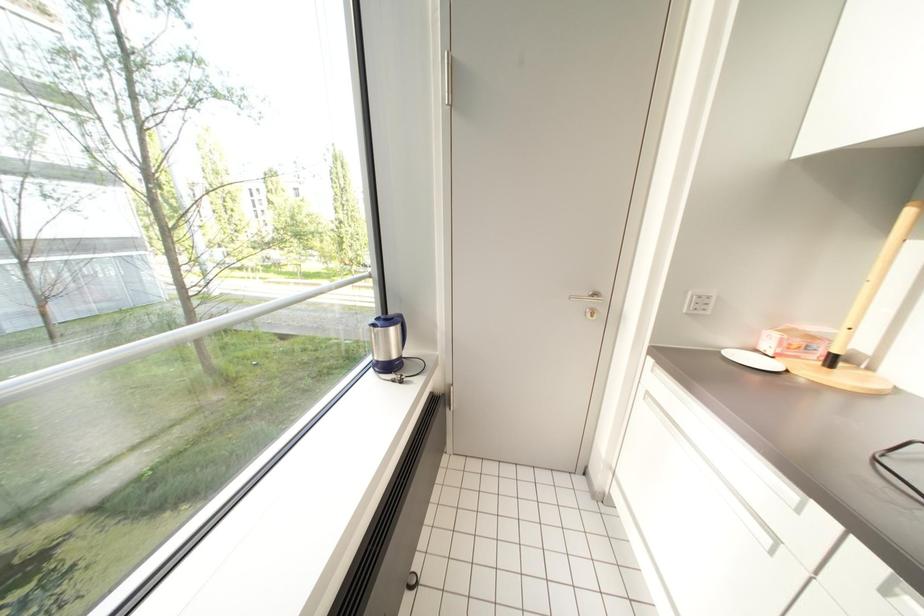
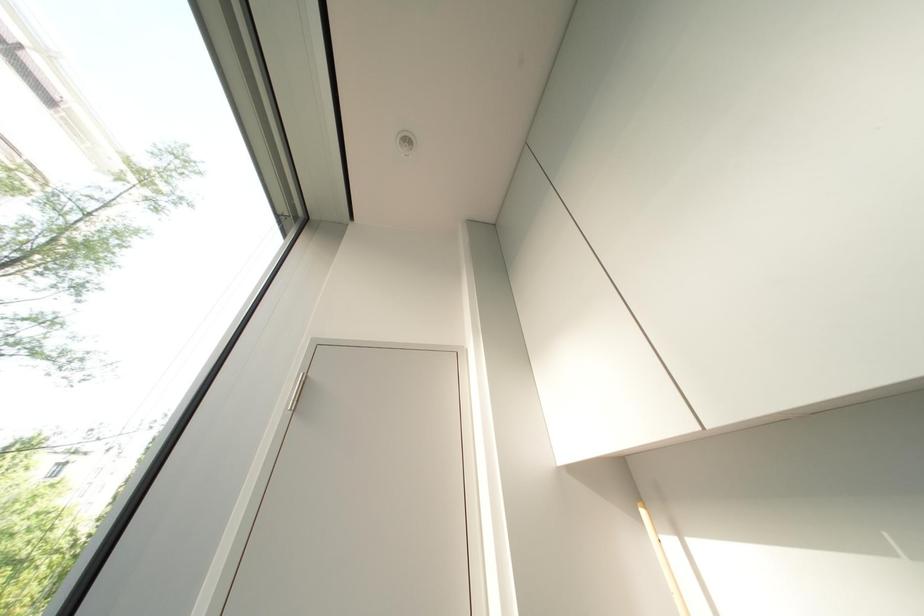
The first image is from the beginning of the video and the second image is from the end. How did the camera likely rotate when shooting the video?

The camera rotated toward right-up.